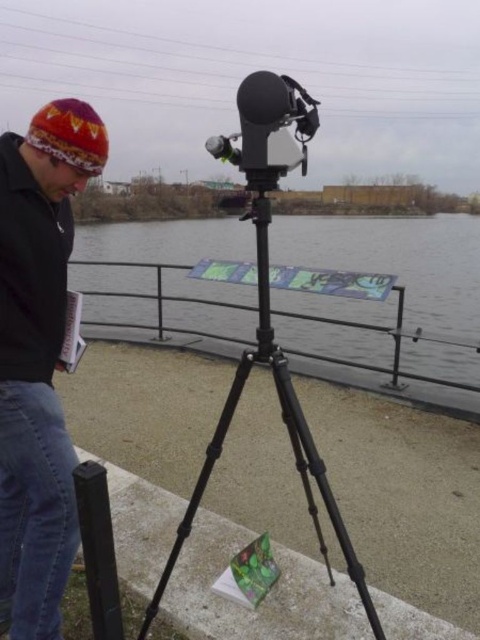
Is point (297, 460) closer to camera compared to point (255, 147)?

No, it is not.

Image resolution: width=480 pixels, height=640 pixels. In order to click on black matte tripod at center in this screenshot , I will do 286,426.

This screenshot has width=480, height=640. Identify the location of transparent plastic water at center. (405, 276).

Which is in front, point (436, 285) or point (7, 349)?

Point (7, 349)

Is point (277, 317) closer to camera compared to point (32, 204)?

No, (277, 317) is behind (32, 204).

Find the location of `transparent plastic water at center`. transparent plastic water at center is located at coordinates (405, 276).

Is point (28, 273) farther from camera compared to point (267, 362)?

No, (28, 273) is in front of (267, 362).

Is knitted woolen hat at upper left to the right of black matte tripod at center from the viewer's perspective?

Incorrect, knitted woolen hat at upper left is not on the right side of black matte tripod at center.

Locate an element on the screen. knitted woolen hat at upper left is located at coordinates (37, 358).

Where is `knitted woolen hat at upper left`? knitted woolen hat at upper left is located at coordinates (37, 358).